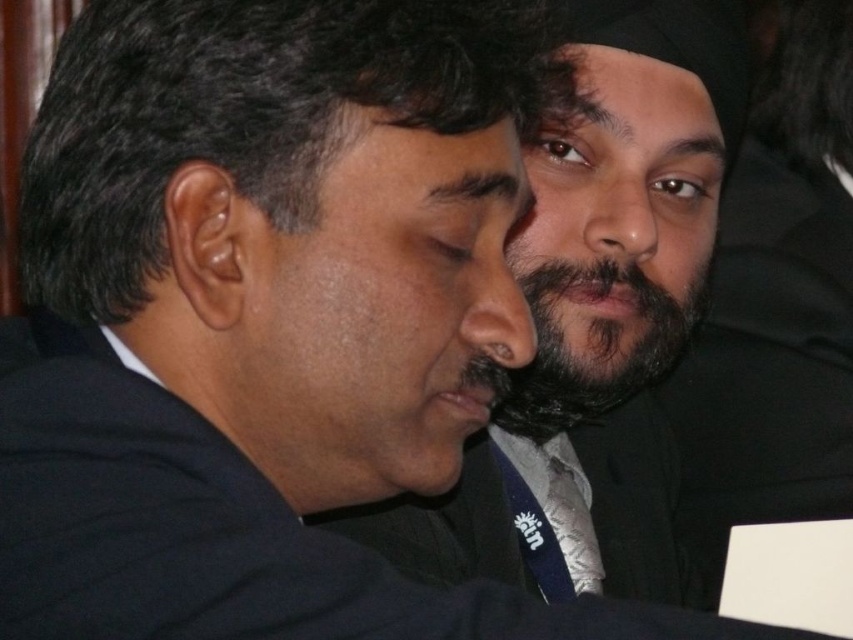
Question: Which object is farther from the camera taking this photo?

Choices:
 (A) silver metallic tie at center
 (B) dark brown fuzzy beard at center
 (C) black matte suit at left
 (D) black matte suit at center

Answer: (A)

Question: Which point is farther to the camera?

Choices:
 (A) silver metallic tie at center
 (B) navy blue silk tie at lower center
 (C) black matte suit at center

Answer: (A)

Question: Does black matte suit at center appear under black matte suit at left?

Choices:
 (A) yes
 (B) no

Answer: (B)

Question: Does black matte suit at center appear over black matte suit at left?

Choices:
 (A) yes
 (B) no

Answer: (A)

Question: Is the position of black matte suit at center more distant than that of silver metallic tie at center?

Choices:
 (A) no
 (B) yes

Answer: (A)

Question: Which object is the farthest from the navy blue silk tie at lower center?

Choices:
 (A) black matte suit at left
 (B) silver metallic tie at center
 (C) dark brown fuzzy beard at center
 (D) black matte suit at center

Answer: (A)